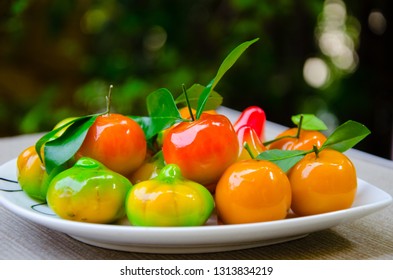
Locate an element on the screen. tablecloth is located at coordinates (36, 242).